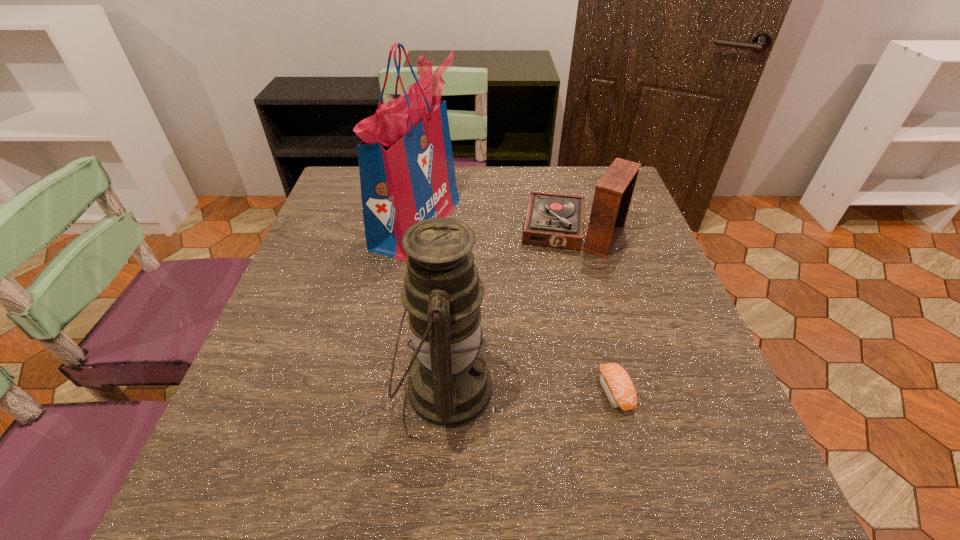
Where is `the tallest object`? The width and height of the screenshot is (960, 540). the tallest object is located at coordinates [x=406, y=166].

Identify the location of the third shortest object. This screenshot has height=540, width=960. (450, 386).

The width and height of the screenshot is (960, 540). I want to click on phonograph record, so click(554, 220).

Where is `sushi`? Image resolution: width=960 pixels, height=540 pixels. sushi is located at coordinates (614, 380).

The height and width of the screenshot is (540, 960). What are the coordinates of `free spot located 0.250m on the front-facing side of the tallest object` in the screenshot? It's located at (556, 223).

You are a GUI agent. You are given a task and a screenshot of the screen. Output one action in this format:
    pyautogui.click(x=<x>, y=<y>)
    Task: Click on the free location located 0.070m on the back of the oil lamp
    The height and width of the screenshot is (540, 960).
    Given the screenshot: What is the action you would take?
    pyautogui.click(x=450, y=312)

At what (x,y) coordinates should I click in order to perform the action: click on free space located on the back of the third tallest object. Please return your answer as a coordinate pair (x, y). Looking at the image, I should click on pyautogui.click(x=562, y=185).

Find the location of `vacant space located 0.300m on the left of the shortest object`. vacant space located 0.300m on the left of the shortest object is located at coordinates (429, 391).

Identify the location of grocery bag that is at the far edge. (406, 166).

Identify the location of phonograph record present at the far edge. This screenshot has width=960, height=540. (554, 220).